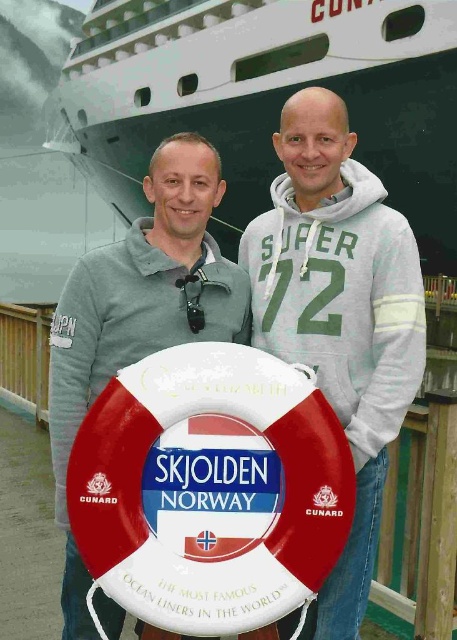
Question: Considering the real-world distances, which object is closest to the white plastic lifebuoy at center?

Choices:
 (A) white matte life preserver at center
 (B) matte gray hoodie at center

Answer: (A)

Question: Is white plastic lifebuoy at center smaller than matte gray hoodie at center?

Choices:
 (A) no
 (B) yes

Answer: (A)

Question: Estimate the real-world distances between objects in this image. Which object is farther from the matte gray hoodie at center?

Choices:
 (A) white matte life preserver at center
 (B) white plastic lifebuoy at center

Answer: (A)

Question: Which object appears closest to the camera in this image?

Choices:
 (A) white matte life preserver at center
 (B) matte gray hoodie at center

Answer: (A)

Question: Does white plastic lifebuoy at center appear under white matte life preserver at center?

Choices:
 (A) yes
 (B) no

Answer: (A)

Question: Where is white plastic lifebuoy at center located in relation to white matte life preserver at center in the image?

Choices:
 (A) above
 (B) below

Answer: (B)